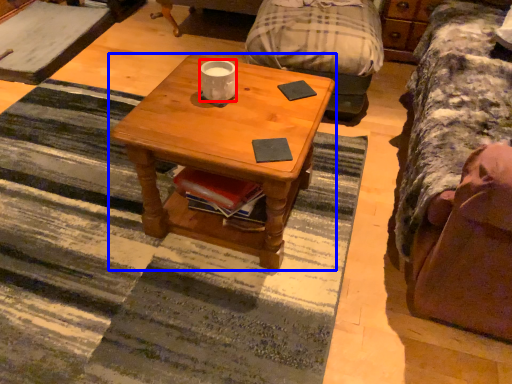
Question: Which object appears closest to the camera in this image, coffee cup (highlighted by a red box) or coffee table (highlighted by a blue box)?

Choices:
 (A) coffee cup
 (B) coffee table

Answer: (B)